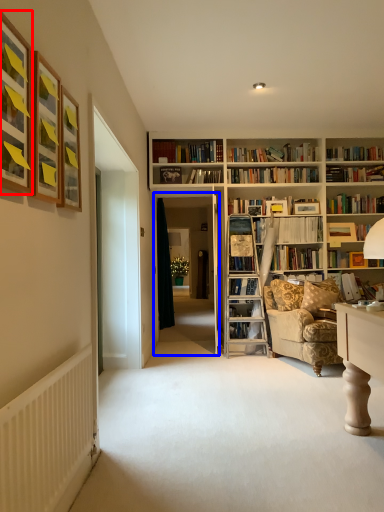
Question: Among these objects, which one is nearest to the camera, picture frame (highlighted by a red box) or glass door (highlighted by a blue box)?

Choices:
 (A) picture frame
 (B) glass door

Answer: (A)